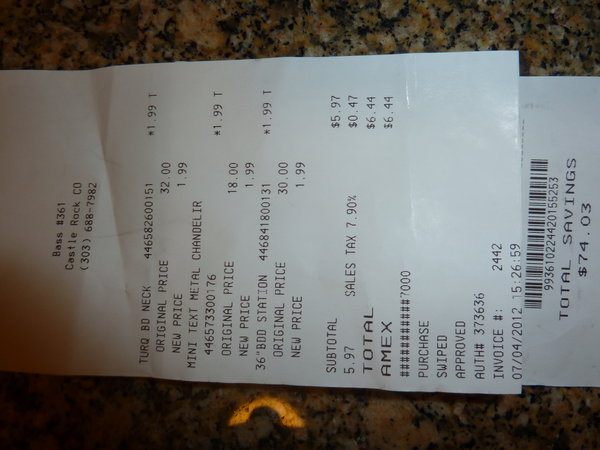
Image resolution: width=600 pixels, height=450 pixels. I want to click on table, so click(x=405, y=407).